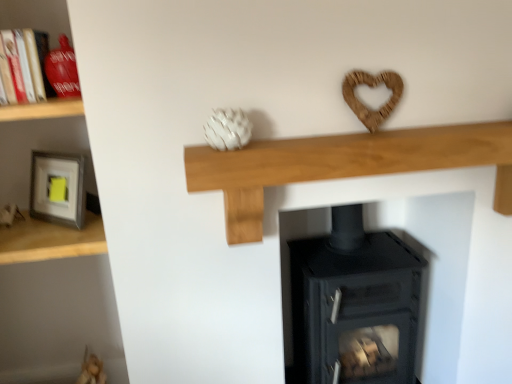
Question: Is point (33, 57) closer or farther from the camera than point (331, 208)?

Choices:
 (A) closer
 (B) farther

Answer: (A)

Question: Do you think matte red vase at upper left is within black matte wood burning stove at center, or outside of it?

Choices:
 (A) outside
 (B) inside

Answer: (A)

Question: Which is nearer to the matte gray frame at left, which ranks as the second shelf in left-to-right order?

Choices:
 (A) wooden shelf at left, which appears as the 2th shelf when viewed from the right
 (B) matte red vase at upper left
 (C) matte gray frame at left, arranged as the fourth shelf when viewed from the right
 (D) black matte wood burning stove at center
 (E) natural wood mantle at center, which ranks as the first shelf in right-to-left order

Answer: (C)

Question: Estimate the real-world distances between objects in this image. Which object is farther from the wooden shelf at left, acting as the 3th shelf starting from the left?

Choices:
 (A) matte red vase at upper left
 (B) matte gray frame at left, arranged as the fourth shelf when viewed from the right
 (C) natural wood mantle at center, which ranks as the first shelf in right-to-left order
 (D) matte gray frame at left, arranged as the third shelf when viewed from the right
 (E) black matte wood burning stove at center

Answer: (E)